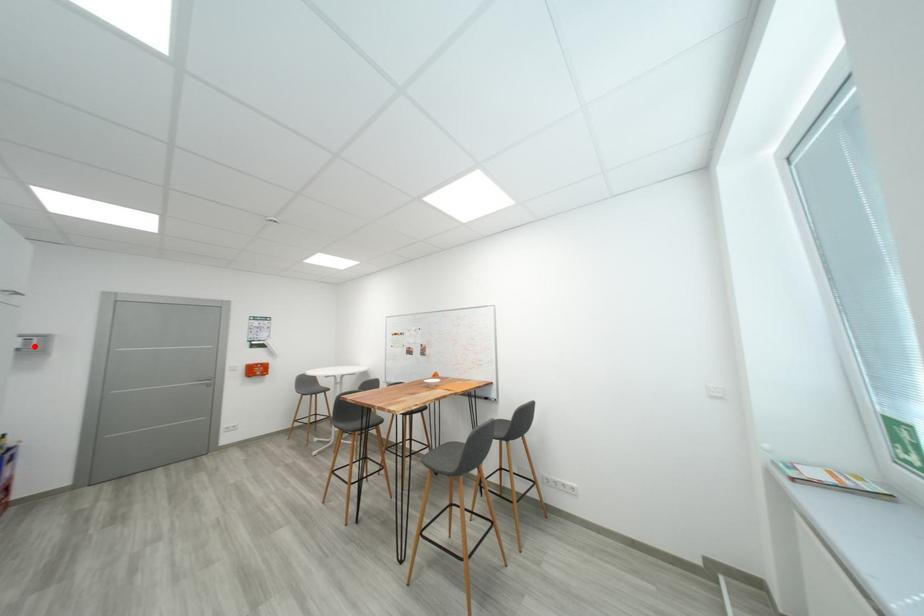
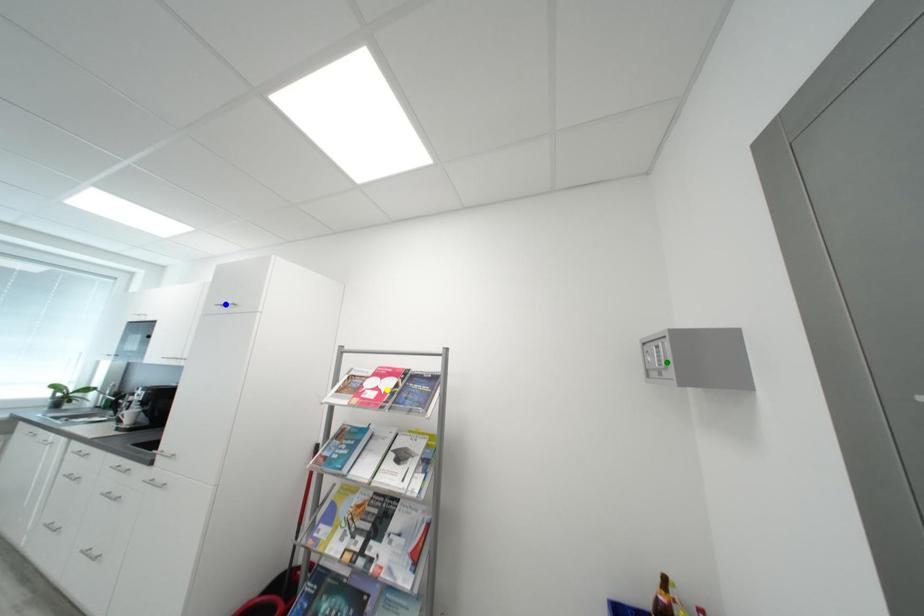
Question: I am providing you with two images of the same scene from different viewpoints. A red point is marked on the first image. You are given multiple points on the second image. Which point in image 2 is actually the same real-world point as the red point in image 1?

Choices:
 (A) yellow point
 (B) green point
 (C) blue point

Answer: (B)